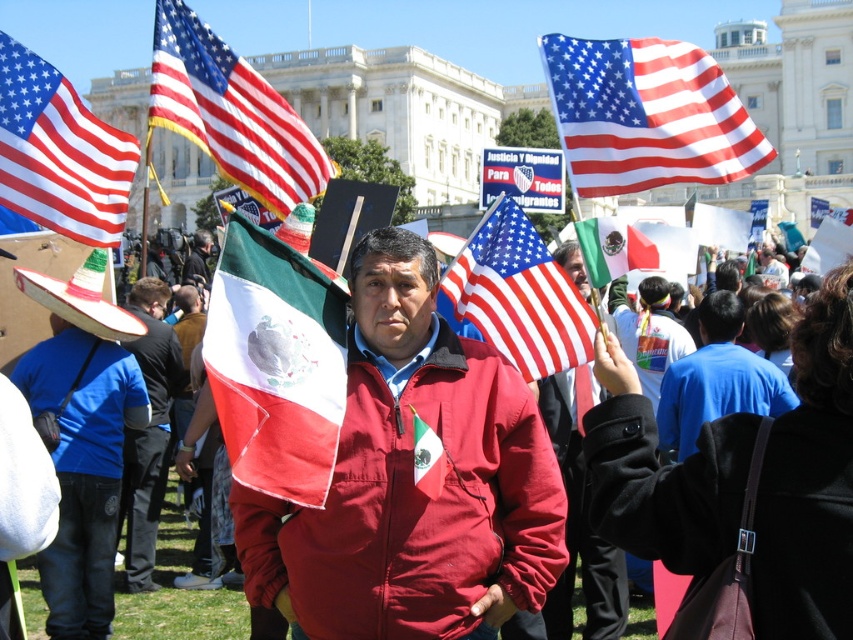
Who is shorter, black leather jacket at lower right or matte red-white-blue flag at upper left?

Standing shorter between the two is black leather jacket at lower right.

The height and width of the screenshot is (640, 853). In order to click on black leather jacket at lower right in this screenshot , I will do (x=666, y=484).

What do you see at coordinates (666, 484) in the screenshot? The image size is (853, 640). I see `black leather jacket at lower right` at bounding box center [666, 484].

I want to click on black leather jacket at lower right, so click(666, 484).

Does matte red-white-blue flag at upper left appear under dark brown leather jacket at center?

Actually, matte red-white-blue flag at upper left is above dark brown leather jacket at center.

Can you confirm if matte red-white-blue flag at upper left is positioned to the left of dark brown leather jacket at center?

No, matte red-white-blue flag at upper left is not to the left of dark brown leather jacket at center.

Between point (62, 161) and point (206, 284), which one is positioned behind?

Point (206, 284)

Where is `matte red-white-blue flag at upper left`? matte red-white-blue flag at upper left is located at coordinates (59, 152).

Consider the image. Is red/white/blue fabric american flag at upper left smaller than red and green fabric flag at center?

No, red/white/blue fabric american flag at upper left is not smaller than red and green fabric flag at center.

Does red/white/blue fabric american flag at upper left appear on the right side of red and green fabric flag at center?

In fact, red/white/blue fabric american flag at upper left is to the left of red and green fabric flag at center.

Which is behind, point (234, 81) or point (593, 268)?

The point (593, 268) is more distant.

Where is `red/white/blue fabric american flag at upper left`? The height and width of the screenshot is (640, 853). red/white/blue fabric american flag at upper left is located at coordinates (231, 113).